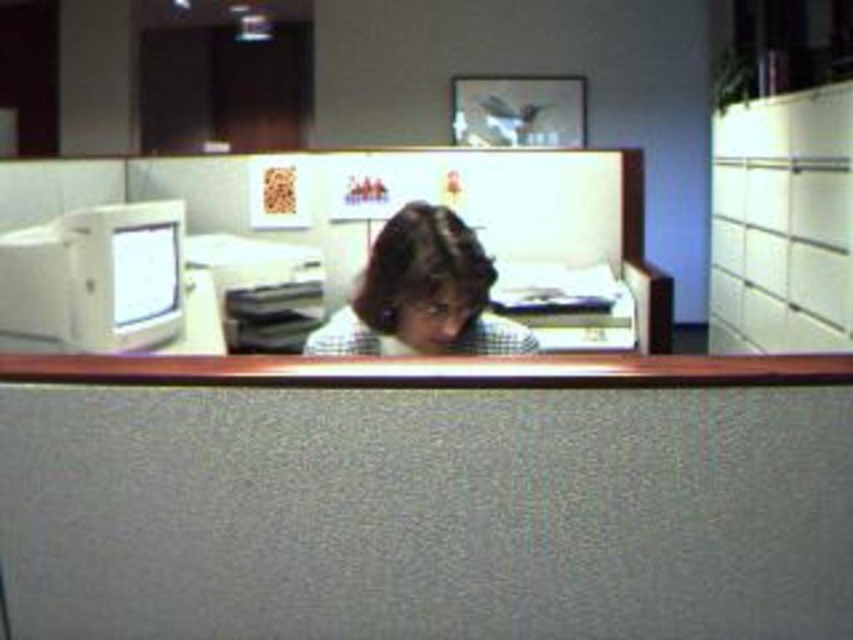
Does brown fabric table at center have a lesser width compared to white glossy file cabinet at right?

No.

Locate an element on the screen. This screenshot has height=640, width=853. brown fabric table at center is located at coordinates (427, 499).

Locate an element on the screen. This screenshot has width=853, height=640. brown fabric table at center is located at coordinates (427, 499).

Who is taller, matte white monitor at left or white glossy monitor at left?

matte white monitor at left is taller.

Which is more to the right, matte white monitor at left or white glossy monitor at left?

white glossy monitor at left is more to the right.

Does point (67, 234) lie behind point (154, 250)?

No, (67, 234) is closer to viewer.

The height and width of the screenshot is (640, 853). I want to click on matte white monitor at left, so click(96, 276).

Is white glossy file cabinet at right behind matte white monitor at left?

Yes.

Between white glossy file cabinet at right and matte white monitor at left, which one appears on the right side from the viewer's perspective?

From the viewer's perspective, white glossy file cabinet at right appears more on the right side.

I want to click on white glossy file cabinet at right, so click(782, 220).